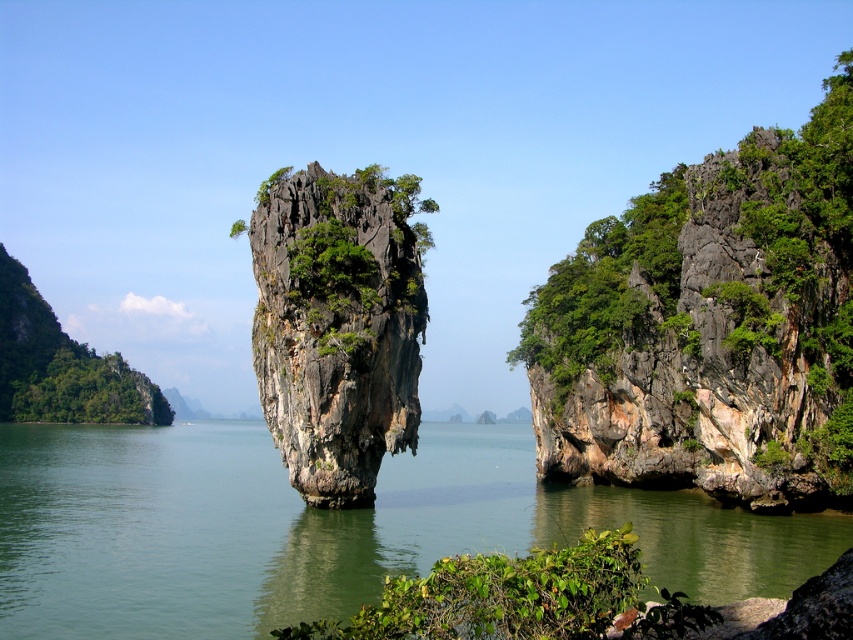
Does green rough rock at right come in front of green leafy bush at lower center?

No, it is behind green leafy bush at lower center.

Which is behind, point (706, 340) or point (547, 564)?

The point (706, 340) is behind.

Where is `green rough rock at right`? The width and height of the screenshot is (853, 640). green rough rock at right is located at coordinates pyautogui.click(x=711, y=326).

Can you confirm if green rough rock at right is smaller than green leafy tree at left?

Result: Correct, green rough rock at right occupies less space than green leafy tree at left.

Between green rough rock at right and green leafy tree at left, which one is positioned higher?

green rough rock at right is higher up.

Measure the distance between green rough rock at right and camera.

green rough rock at right and camera are 62.75 meters apart from each other.

Image resolution: width=853 pixels, height=640 pixels. I want to click on green rough rock at right, so click(711, 326).

Is point (579, 362) behind point (305, 326)?

Yes, point (579, 362) is farther from viewer.

From the picture: Which is more to the left, green rough rock at right or rugged stone rock at center?

rugged stone rock at center

Between point (735, 266) and point (366, 312), which one is positioned in front?

Positioned in front is point (366, 312).

Where is `green rough rock at right`? The image size is (853, 640). green rough rock at right is located at coordinates (711, 326).